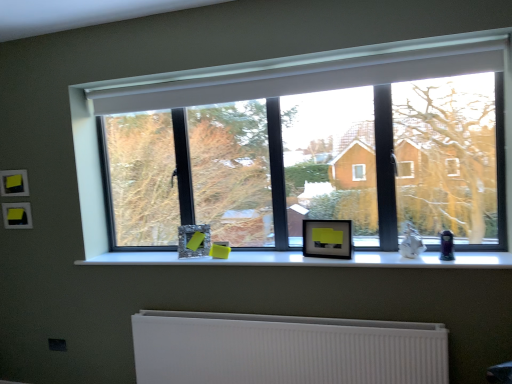
The height and width of the screenshot is (384, 512). Describe the element at coordinates (327, 239) in the screenshot. I see `black matte picture frame at center, which is the 1th picture frame in front-to-back order` at that location.

At what (x,y) coordinates should I click in order to perform the action: click on matte glass picture frame at center, which ranks as the second picture frame in right-to-left order. Please return your answer as a coordinate pair (x, y). Looking at the image, I should click on (194, 240).

Describe the element at coordinates (264, 95) in the screenshot. I see `transparent glass window at center` at that location.

In order to face white ribbed radiator at lower center, should I rotate leftwards or rightwards?

A 1.831 degree turn to the right will do.

Find the location of a particular element. white matte window sill at center is located at coordinates (309, 260).

The height and width of the screenshot is (384, 512). Identify the location of black matte picture frame at center, marked as the second picture frame in a left-to-right arrangement. (327, 239).

Considering the positions of objects white matte window sill at center and black matte picture frame at center, which is counted as the 1th picture frame, starting from the right, in the image provided, who is more to the left, white matte window sill at center or black matte picture frame at center, which is counted as the 1th picture frame, starting from the right,?

Positioned to the left is white matte window sill at center.

From a real-world perspective, is white matte window sill at center positioned over black matte picture frame at center, which is counted as the 1th picture frame, starting from the right, based on gravity?

No, from a real-world perspective, white matte window sill at center is not on top of black matte picture frame at center, which is counted as the 1th picture frame, starting from the right.

From the picture: Is black matte picture frame at center, which is counted as the 1th picture frame, starting from the right, a part of white matte window sill at center?

No, black matte picture frame at center, which is counted as the 1th picture frame, starting from the right, is not surrounded by white matte window sill at center.

Between white matte window sill at center and black matte picture frame at center, which is the 1th picture frame in front-to-back order, which one has smaller size?

black matte picture frame at center, which is the 1th picture frame in front-to-back order.

From the image's perspective, would you say matte glass picture frame at center, the 1th picture frame from the back, is positioned over white ribbed radiator at lower center?

Correct, matte glass picture frame at center, the 1th picture frame from the back, appears higher than white ribbed radiator at lower center in the image.

Is matte glass picture frame at center, arranged as the second picture frame when viewed from the front, inside or outside of white ribbed radiator at lower center?

matte glass picture frame at center, arranged as the second picture frame when viewed from the front, is spatially situated outside white ribbed radiator at lower center.

From a real-world perspective, relative to white ribbed radiator at lower center, is matte glass picture frame at center, which ranks as the second picture frame in right-to-left order, vertically above or below?

matte glass picture frame at center, which ranks as the second picture frame in right-to-left order, is above white ribbed radiator at lower center.

Considering the positions of point (193, 233) and point (352, 381), is point (193, 233) closer or farther from the camera than point (352, 381)?

Point (193, 233) is farther from the camera than point (352, 381).

Is white matte window sill at center positioned behind matte glass picture frame at center, the 1th picture frame from the back?

No.

In the scene shown: From a real-world perspective, who is located lower, white matte window sill at center or matte glass picture frame at center, the 1th picture frame from the back?

From a 3D spatial view, white matte window sill at center is below.

Measure the distance between white matte window sill at center and matte glass picture frame at center, which ranks as the second picture frame in right-to-left order.

white matte window sill at center and matte glass picture frame at center, which ranks as the second picture frame in right-to-left order, are 15.51 inches apart from each other.

Can you confirm if white matte window sill at center is taller than matte glass picture frame at center, the 1th picture frame from the back?

In fact, white matte window sill at center may be shorter than matte glass picture frame at center, the 1th picture frame from the back.

Does black matte picture frame at center, which is the 1th picture frame in front-to-back order, appear on the right side of transparent glass window at center?

Indeed, black matte picture frame at center, which is the 1th picture frame in front-to-back order, is positioned on the right side of transparent glass window at center.

Can you confirm if black matte picture frame at center, which is counted as the 1th picture frame, starting from the right, is bigger than transparent glass window at center?

No, black matte picture frame at center, which is counted as the 1th picture frame, starting from the right, is not bigger than transparent glass window at center.

From a real-world perspective, between black matte picture frame at center, which is the 2th picture frame in back-to-front order, and transparent glass window at center, who is vertically higher?

In real-world perspective, transparent glass window at center is above.

Is black matte picture frame at center, which is counted as the 1th picture frame, starting from the right, far away from transparent glass window at center?

Yes, black matte picture frame at center, which is counted as the 1th picture frame, starting from the right, and transparent glass window at center are located far from each other.

Find the location of `window sill located in front of the white ribbed radiator at lower center`. window sill located in front of the white ribbed radiator at lower center is located at coordinates (309, 260).

Which is in front, point (492, 261) or point (425, 355)?

Point (425, 355)

From the picture: Who is smaller, white matte window sill at center or white ribbed radiator at lower center?

Smaller between the two is white matte window sill at center.

Is there a large distance between white matte window sill at center and white ribbed radiator at lower center?

That's not correct — white matte window sill at center is a little close to white ribbed radiator at lower center.

Considering the positions of objects black matte picture frame at center, which is counted as the 1th picture frame, starting from the right, and white matte window sill at center in the image provided, who is more to the right, black matte picture frame at center, which is counted as the 1th picture frame, starting from the right, or white matte window sill at center?

black matte picture frame at center, which is counted as the 1th picture frame, starting from the right.

Considering the positions of points (336, 255) and (480, 263), is point (336, 255) farther from camera compared to point (480, 263)?

Yes, it is.

From the image's perspective, which picture frame is the 2nd one above the white matte window sill at center? Please provide its 2D coordinates.

[(327, 239)]

What's the angular difference between black matte picture frame at center, marked as the second picture frame in a left-to-right arrangement, and white matte window sill at center's facing directions?

There is a 11.3-degree angle between the facing directions of black matte picture frame at center, marked as the second picture frame in a left-to-right arrangement, and white matte window sill at center.

Would you say matte glass picture frame at center, which ranks as the 1th picture frame in left-to-right order, is inside or outside black matte picture frame at center, which is counted as the 1th picture frame, starting from the right?

matte glass picture frame at center, which ranks as the 1th picture frame in left-to-right order, is not enclosed by black matte picture frame at center, which is counted as the 1th picture frame, starting from the right.

From the image's perspective, does matte glass picture frame at center, which ranks as the 1th picture frame in left-to-right order, appear lower than black matte picture frame at center, which is the 1th picture frame in front-to-back order?

Correct, matte glass picture frame at center, which ranks as the 1th picture frame in left-to-right order, appears lower than black matte picture frame at center, which is the 1th picture frame in front-to-back order, in the image.

From a real-world perspective, is matte glass picture frame at center, which ranks as the 1th picture frame in left-to-right order, physically located above or below black matte picture frame at center, marked as the second picture frame in a left-to-right arrangement?

matte glass picture frame at center, which ranks as the 1th picture frame in left-to-right order, is situated lower than black matte picture frame at center, marked as the second picture frame in a left-to-right arrangement, in the real world.

At what (x,y) coordinates should I click in order to perform the action: click on the 2nd picture frame positioned above the white matte window sill at center (from a real-world perspective). Please return your answer as a coordinate pair (x, y). Image resolution: width=512 pixels, height=384 pixels. Looking at the image, I should click on (327, 239).

Locate an element on the screen. The height and width of the screenshot is (384, 512). picture frame on the left side of white ribbed radiator at lower center is located at coordinates (194, 240).

Estimate the real-world distances between objects in this image. Which object is further from transparent glass window at center, black matte picture frame at center, which is the 1th picture frame in front-to-back order, or matte glass picture frame at center, which ranks as the 1th picture frame in left-to-right order?

The object further to transparent glass window at center is black matte picture frame at center, which is the 1th picture frame in front-to-back order.

Considering their positions, is white matte window sill at center positioned further to transparent glass window at center than black matte picture frame at center, marked as the second picture frame in a left-to-right arrangement?

black matte picture frame at center, marked as the second picture frame in a left-to-right arrangement.

When comparing their distances from black matte picture frame at center, which is counted as the 1th picture frame, starting from the right, does matte glass picture frame at center, which ranks as the 1th picture frame in left-to-right order, or white matte window sill at center seem closer?

Based on the image, white matte window sill at center appears to be nearer to black matte picture frame at center, which is counted as the 1th picture frame, starting from the right.

Looking at the image, which one is located further to matte glass picture frame at center, arranged as the second picture frame when viewed from the front, white matte window sill at center or black matte picture frame at center, which is the 1th picture frame in front-to-back order?

black matte picture frame at center, which is the 1th picture frame in front-to-back order, is positioned further to the anchor matte glass picture frame at center, arranged as the second picture frame when viewed from the front.

Looking at the image, which one is located further to transparent glass window at center, white ribbed radiator at lower center or matte glass picture frame at center, which ranks as the second picture frame in right-to-left order?

white ribbed radiator at lower center is further to transparent glass window at center.

Looking at this image, from the image, which object appears to be nearer to white ribbed radiator at lower center, white matte window sill at center or black matte picture frame at center, marked as the second picture frame in a left-to-right arrangement?

The object closer to white ribbed radiator at lower center is white matte window sill at center.

Based on their spatial positions, is matte glass picture frame at center, arranged as the second picture frame when viewed from the front, or black matte picture frame at center, which is counted as the 1th picture frame, starting from the right, closer to white matte window sill at center?

The object closer to white matte window sill at center is black matte picture frame at center, which is counted as the 1th picture frame, starting from the right.

Looking at the image, which one is located closer to transparent glass window at center, white matte window sill at center or white ribbed radiator at lower center?

white matte window sill at center lies closer to transparent glass window at center than the other object.

This screenshot has height=384, width=512. What are the coordinates of `window situated between matte glass picture frame at center, the 1th picture frame from the back, and black matte picture frame at center, which is the 2th picture frame in back-to-front order, from left to right` in the screenshot? It's located at (264, 95).

At what (x,y) coordinates should I click in order to perform the action: click on window sill between black matte picture frame at center, which is counted as the 1th picture frame, starting from the right, and white ribbed radiator at lower center, in the vertical direction. Please return your answer as a coordinate pair (x, y). Looking at the image, I should click on (309, 260).

I want to click on window between white matte window sill at center and matte glass picture frame at center, which ranks as the 1th picture frame in left-to-right order, from front to back, so click(x=264, y=95).

The width and height of the screenshot is (512, 384). Identify the location of radiator between matte glass picture frame at center, which ranks as the second picture frame in right-to-left order, and black matte picture frame at center, which is counted as the 1th picture frame, starting from the right. (285, 349).